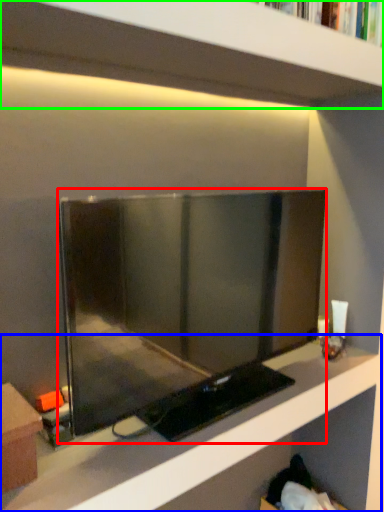
Question: Which object is the closest to the television (highlighted by a red box)? Choose among these: shelf (highlighted by a blue box) or shelf (highlighted by a green box).

Choices:
 (A) shelf
 (B) shelf

Answer: (A)